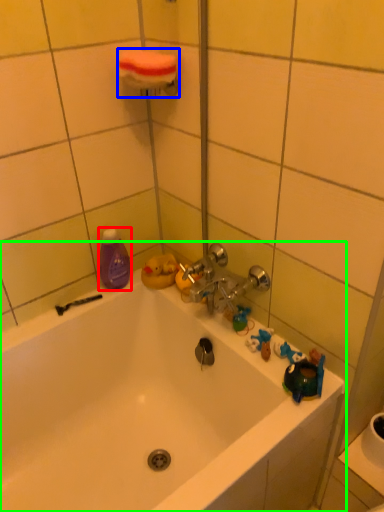
Question: Which is farther away from cleaning product (highlighted by a red box)? towel bar (highlighted by a blue box) or bathtub (highlighted by a green box)?

Choices:
 (A) towel bar
 (B) bathtub

Answer: (A)